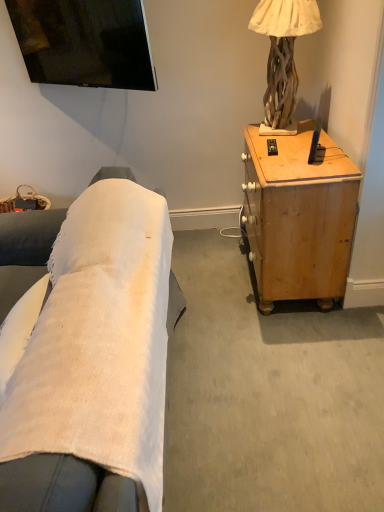
Question: Is light brown wood desk at right to the left of black plastic remote control at upper right from the viewer's perspective?

Choices:
 (A) yes
 (B) no

Answer: (B)

Question: Can you confirm if light brown wood desk at right is shorter than black plastic remote control at upper right?

Choices:
 (A) yes
 (B) no

Answer: (B)

Question: Is light brown wood desk at right next to black plastic remote control at upper right?

Choices:
 (A) no
 (B) yes

Answer: (A)

Question: Considering the relative sizes of light brown wood desk at right and black plastic remote control at upper right in the image provided, is light brown wood desk at right wider than black plastic remote control at upper right?

Choices:
 (A) no
 (B) yes

Answer: (B)

Question: From a real-world perspective, is light brown wood desk at right over black plastic remote control at upper right?

Choices:
 (A) yes
 (B) no

Answer: (B)

Question: Is the position of light brown wood desk at right more distant than that of black plastic remote control at upper right?

Choices:
 (A) no
 (B) yes

Answer: (A)

Question: Is natural wood lamp at upper right in contact with light brown wood desk at right?

Choices:
 (A) yes
 (B) no

Answer: (B)

Question: Does natural wood lamp at upper right turn towards light brown wood desk at right?

Choices:
 (A) no
 (B) yes

Answer: (A)

Question: Are natural wood lamp at upper right and light brown wood desk at right located far from each other?

Choices:
 (A) yes
 (B) no

Answer: (B)

Question: Is natural wood lamp at upper right oriented away from light brown wood desk at right?

Choices:
 (A) no
 (B) yes

Answer: (A)

Question: Is natural wood lamp at upper right bigger than light brown wood desk at right?

Choices:
 (A) no
 (B) yes

Answer: (A)

Question: Is natural wood lamp at upper right taller than light brown wood desk at right?

Choices:
 (A) no
 (B) yes

Answer: (A)

Question: Can you confirm if black plastic remote control at upper right is bigger than natural wood lamp at upper right?

Choices:
 (A) no
 (B) yes

Answer: (A)